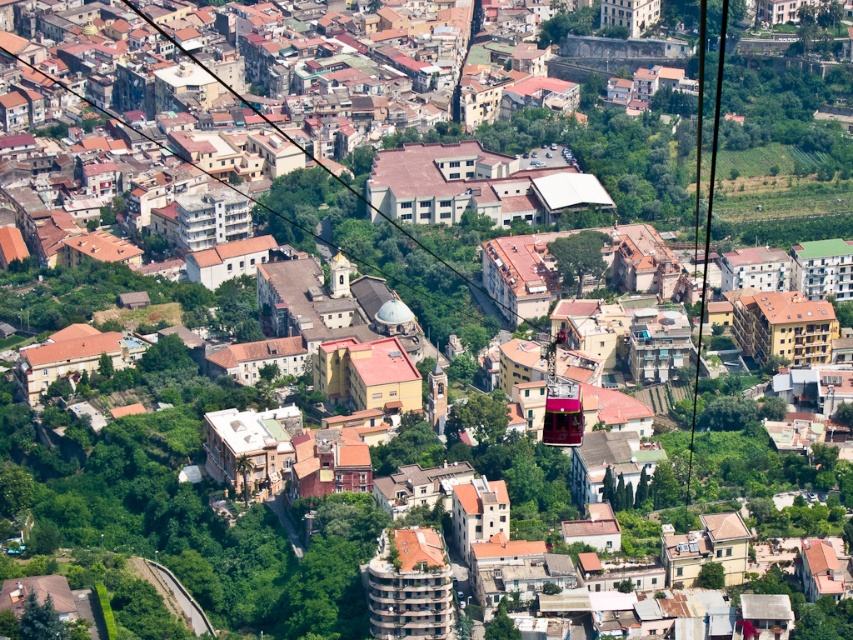
Question: Which of the following is the farthest from the observer?

Choices:
 (A) (573, 392)
 (B) (698, 342)

Answer: (B)

Question: Which point appears closest to the camera in this image?

Choices:
 (A) (718, 106)
 (B) (554, 413)

Answer: (B)

Question: Can you confirm if black cable at right is positioned to the left of metallic cable car at center?

Choices:
 (A) no
 (B) yes

Answer: (A)

Question: Observing the image, what is the correct spatial positioning of black cable at right in reference to metallic cable car at center?

Choices:
 (A) above
 (B) below

Answer: (A)

Question: Is black cable at right to the left of metallic cable car at center from the viewer's perspective?

Choices:
 (A) yes
 (B) no

Answer: (B)